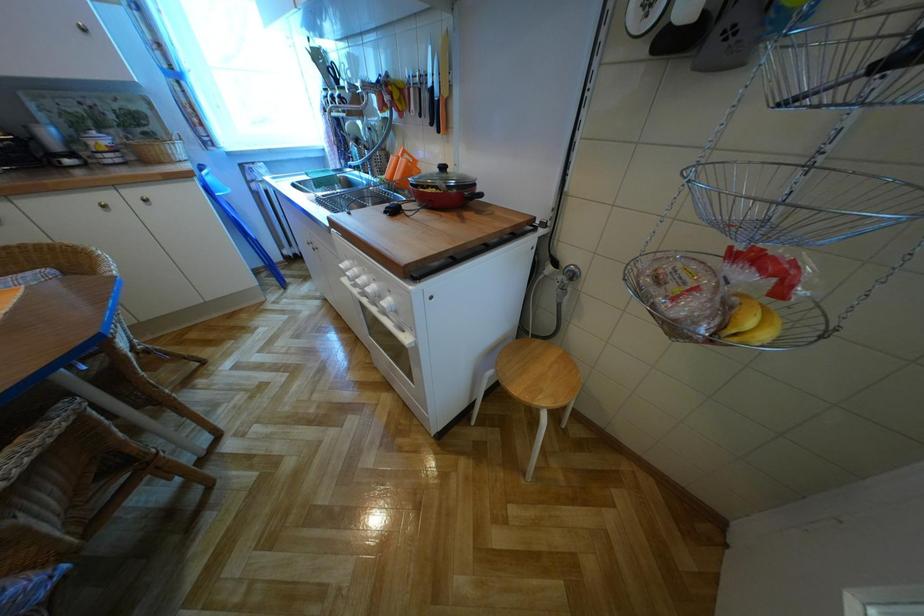
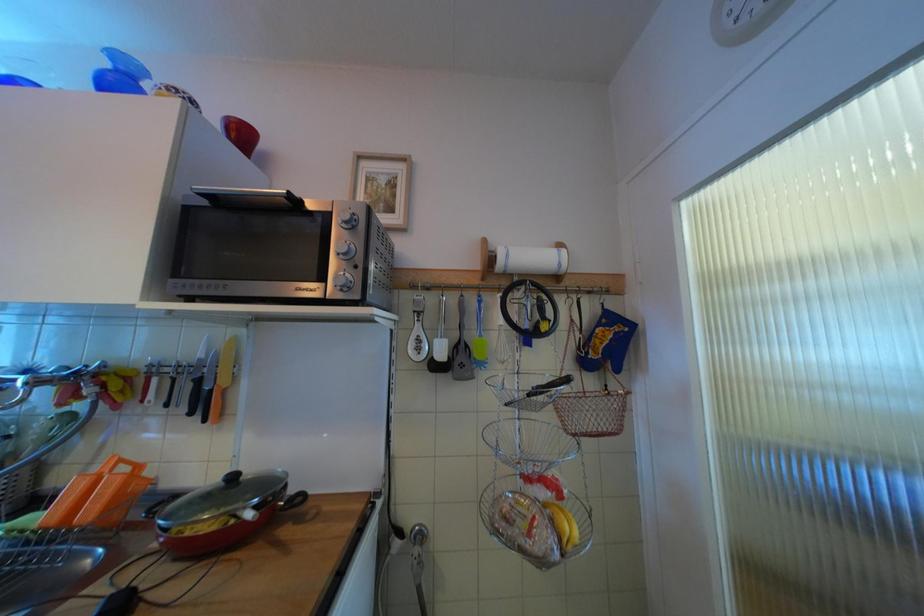
The first image is from the beginning of the video and the second image is from the end. How did the camera likely rotate when shooting the video?

The rotation direction of the camera is right-up.